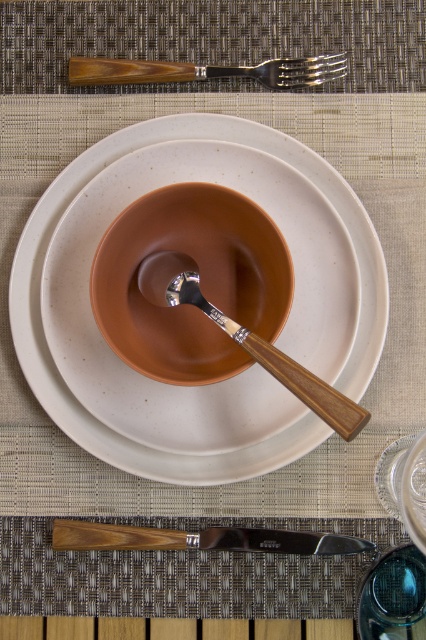
Does polished silver knife at lower center appear under wooden spoon at center?

Correct, polished silver knife at lower center is located below wooden spoon at center.

Based on the photo, does polished silver knife at lower center appear on the left side of wooden spoon at center?

Indeed, polished silver knife at lower center is positioned on the left side of wooden spoon at center.

Between point (290, 540) and point (363, 413), which one is positioned behind?

Point (290, 540)

Locate an element on the screen. polished silver knife at lower center is located at coordinates (199, 538).

Is matte ceramic platter at center closer to the viewer compared to polished silver knife at lower center?

That is True.

Is matte ceramic platter at center further to the viewer compared to polished silver knife at lower center?

No, matte ceramic platter at center is in front of polished silver knife at lower center.

Find the location of a particular element. matte ceramic platter at center is located at coordinates (227, 378).

I want to click on matte ceramic platter at center, so click(227, 378).

Does matte ceramic platter at center have a greater height compared to wooden spoon at center?

Yes, matte ceramic platter at center is taller than wooden spoon at center.

Is matte ceramic platter at center positioned in front of wooden spoon at center?

That is False.

Where is `matte ceramic platter at center`? This screenshot has width=426, height=640. matte ceramic platter at center is located at coordinates coord(227,378).